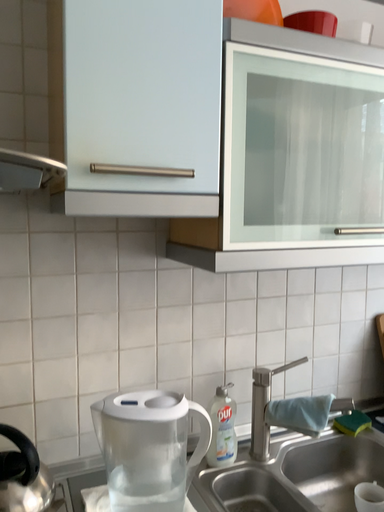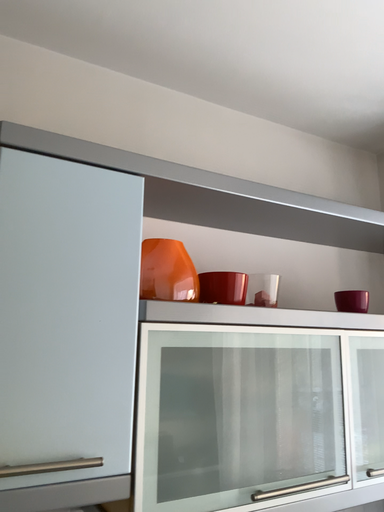
Question: Which way did the camera rotate in the video?

Choices:
 (A) rotated right
 (B) rotated left

Answer: (A)